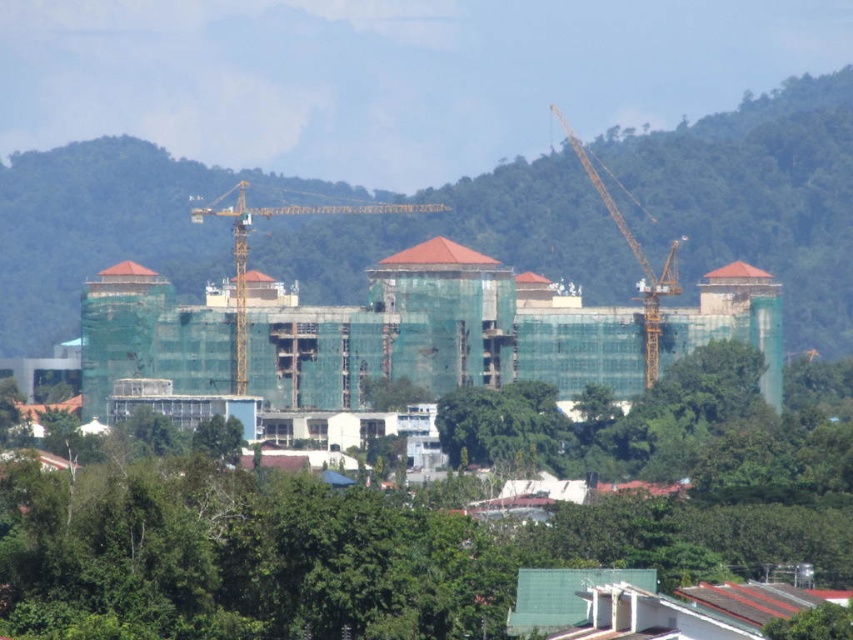
Is point (668, 566) positioned after point (656, 259)?

Yes, point (668, 566) is farther from viewer.

Can you confirm if green leafy tree at center is shorter than green netting building at center?

No, green leafy tree at center is not shorter than green netting building at center.

Which is in front, point (378, 442) or point (740, 220)?

Point (378, 442) is more forward.

This screenshot has width=853, height=640. I want to click on green leafy tree at center, so [x=426, y=516].

Is green leafy tree at center further to camera compared to yellow metallic crane at center?

No, green leafy tree at center is in front of yellow metallic crane at center.

Is point (54, 509) positioned in front of point (236, 234)?

No, it is not.

Find the location of `green leafy tree at center`. green leafy tree at center is located at coordinates (426, 516).

Locate an element on the screen. Image resolution: width=853 pixels, height=640 pixels. green leafy tree at center is located at coordinates (426, 516).

Is green leafy tree at center bigger than yellow metallic crane at right?

Yes.

Is point (254, 634) less distant than point (621, 186)?

That is True.

At what (x,y) coordinates should I click in order to perform the action: click on green leafy tree at center. Please return your answer as a coordinate pair (x, y). The height and width of the screenshot is (640, 853). Looking at the image, I should click on (426, 516).